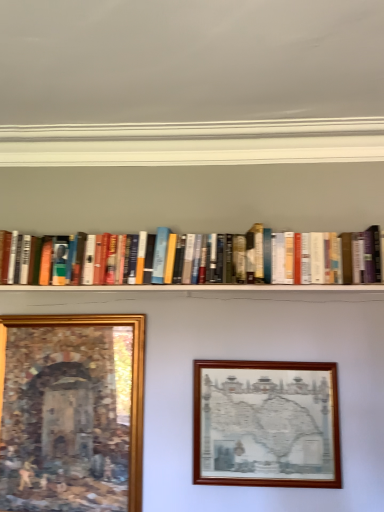
Question: Looking at the image, does hardcover books at center seem bigger or smaller compared to gold-framed painting at lower left, which is the second picture frame in right-to-left order?

Choices:
 (A) small
 (B) big

Answer: (B)

Question: Looking at their shapes, would you say hardcover books at center is wider or thinner than gold-framed painting at lower left, the 1th picture frame viewed from the left?

Choices:
 (A) wide
 (B) thin

Answer: (A)

Question: Estimate the real-world distances between objects in this image. Which object is farther from the hardcover books at center?

Choices:
 (A) gold-framed painting at lower left, the 1th picture frame viewed from the left
 (B) wooden picture frame at center, the 2th picture frame positioned from the left

Answer: (A)

Question: Estimate the real-world distances between objects in this image. Which object is closer to the gold-framed painting at lower left, which is the second picture frame in right-to-left order?

Choices:
 (A) hardcover books at center
 (B) wooden picture frame at center, the first picture frame from the right

Answer: (B)